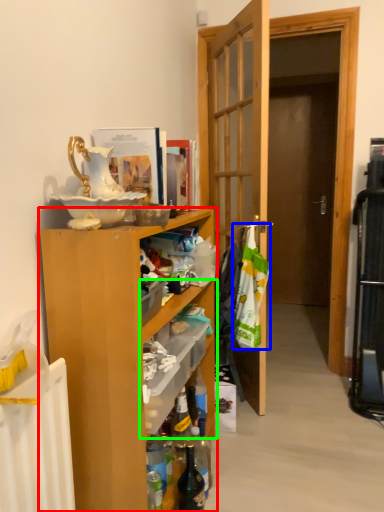
Question: Estimate the real-world distances between objects in this image. Which object is closer to cabinetry (highlighted by a red box), laundry (highlighted by a blue box) or shelf (highlighted by a green box)?

Choices:
 (A) laundry
 (B) shelf

Answer: (B)